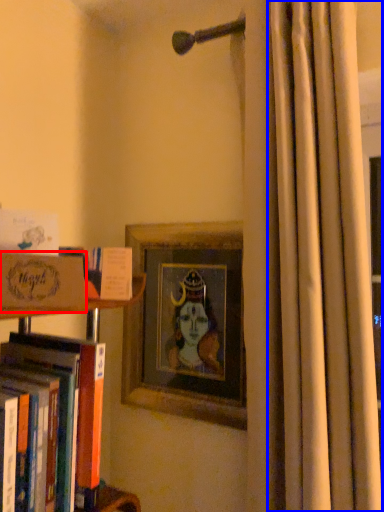
Question: Which point is further to the camera, paperback book (highlighted by a red box) or curtain (highlighted by a blue box)?

Choices:
 (A) paperback book
 (B) curtain

Answer: (B)